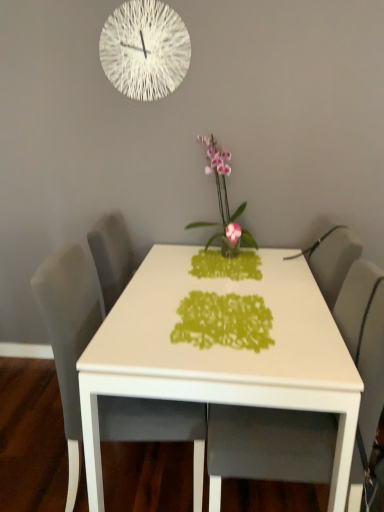
Find the location of a particular element. vacant space to the right of green paper cutout at center is located at coordinates (307, 317).